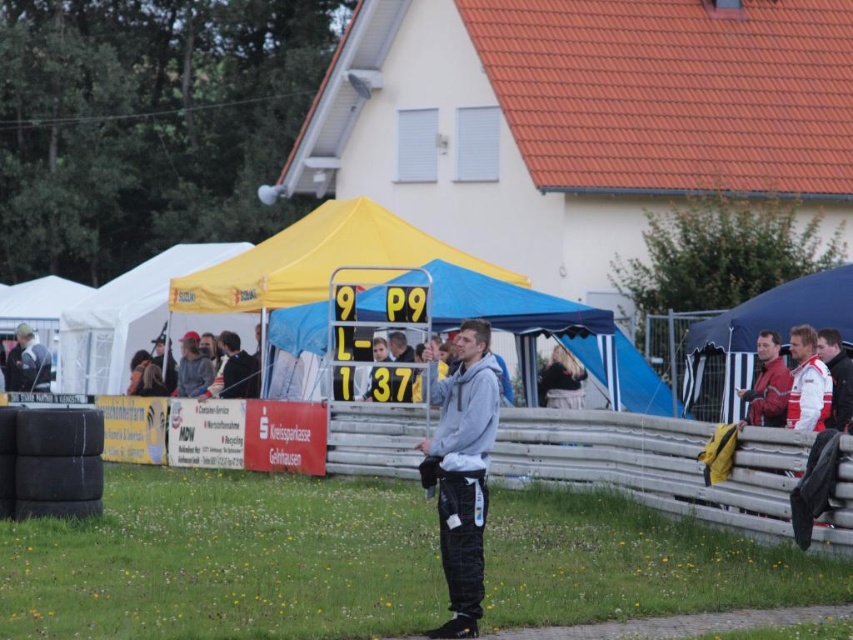
Does blue fabric canopy at right have a smaller size compared to red leather jacket at right?

Correct, blue fabric canopy at right occupies less space than red leather jacket at right.

Does point (834, 292) lie behind point (773, 376)?

Yes.

Locate an element on the screen. This screenshot has height=640, width=853. blue fabric canopy at right is located at coordinates (756, 337).

Does gray fleece jacket at center appear on the right side of blue fabric canopy at right?

No, gray fleece jacket at center is not to the right of blue fabric canopy at right.

Which is in front, point (469, 547) or point (689, 394)?

Positioned in front is point (469, 547).

Is point (483, 593) positioned before point (741, 353)?

Yes.

Find the location of a particular element. The width and height of the screenshot is (853, 640). gray fleece jacket at center is located at coordinates (462, 472).

Is the position of gray fleece jacket at center less distant than that of yellow fabric canopy at upper left?

Yes.

Image resolution: width=853 pixels, height=640 pixels. What are the coordinates of `gray fleece jacket at center` in the screenshot? It's located at [x=462, y=472].

Find the location of a particular element. The image size is (853, 640). gray fleece jacket at center is located at coordinates (462, 472).